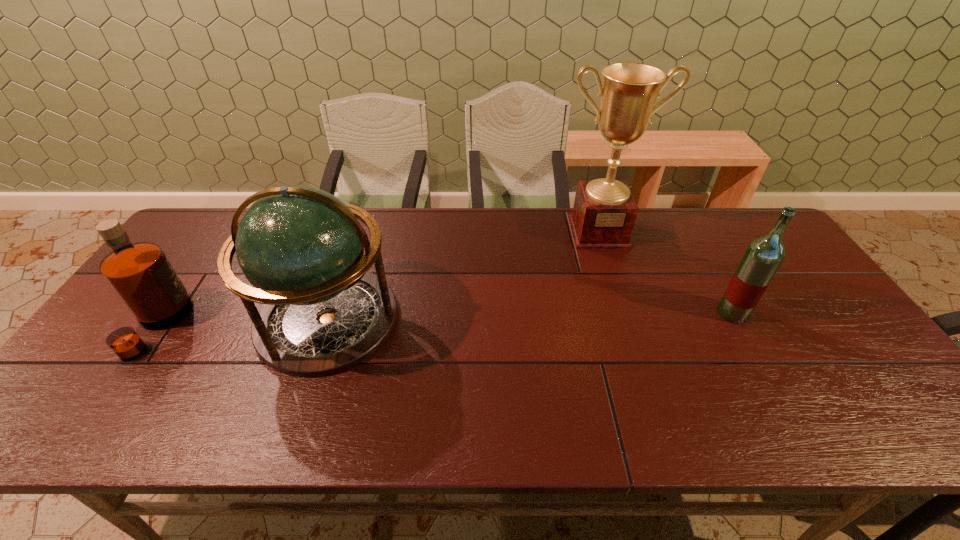
Image resolution: width=960 pixels, height=540 pixels. In order to click on vacant region that satisfies the following two spatial constraints: 1. on the plaque of the third object from left to right; 2. on the left side of the rightmost object in this screenshot , I will do `click(625, 313)`.